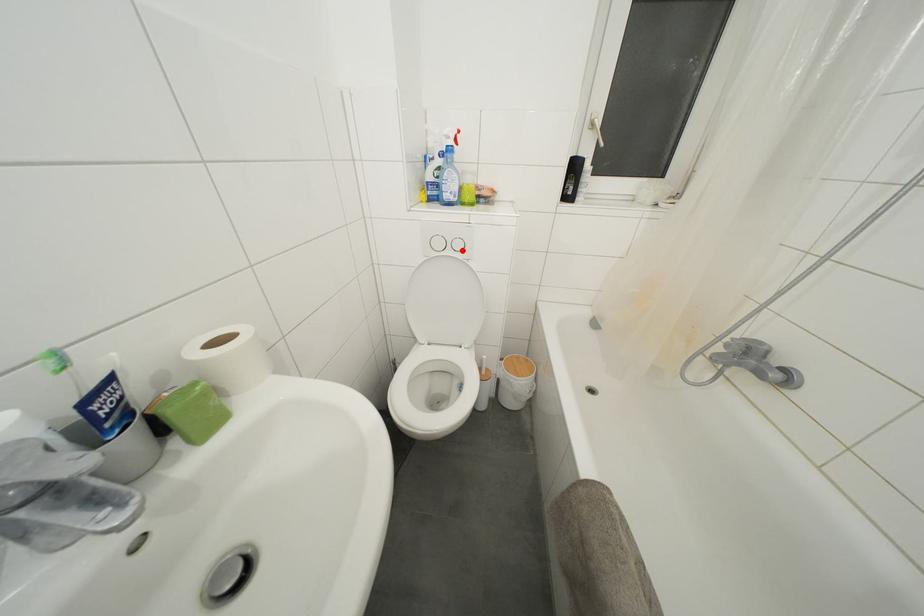
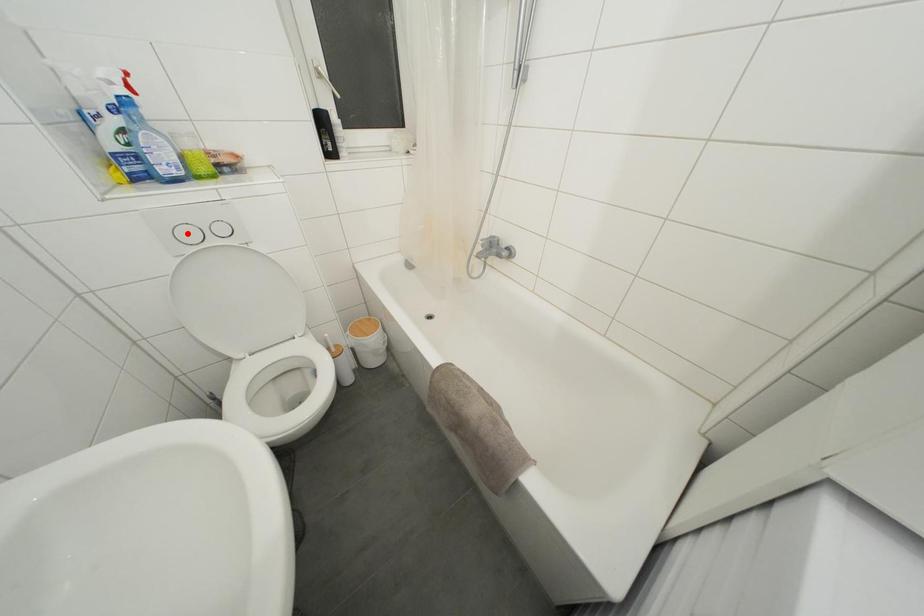
I am providing you with two images of the same scene from different viewpoints. A red point is marked on the first image and another point is marked on the second image. Do the highlighted points in image1 and image2 indicate the same real-world spot?

No